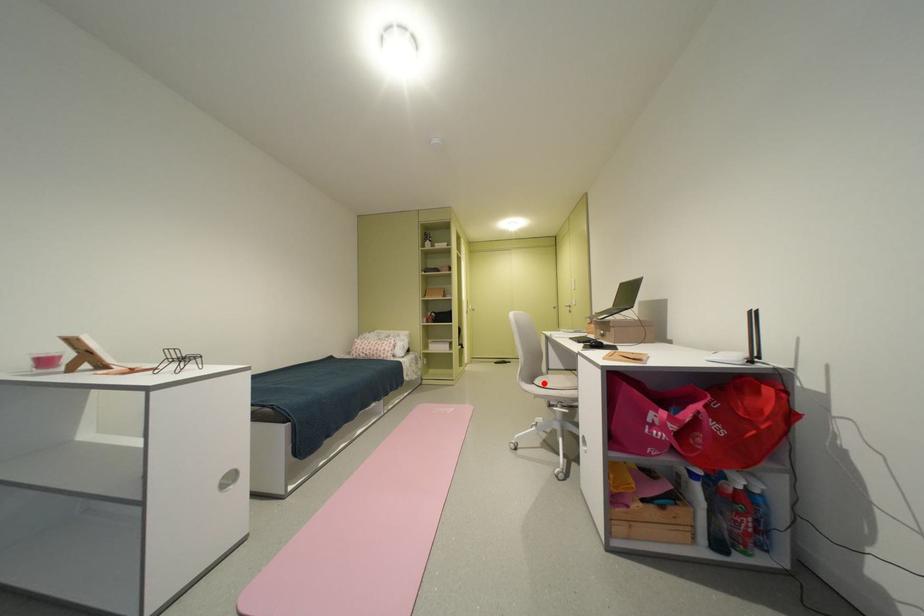
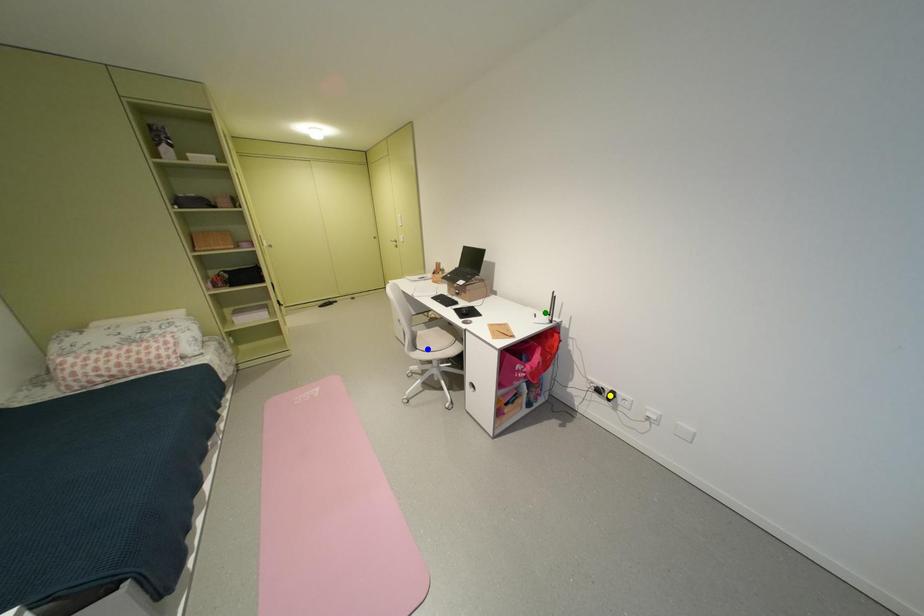
Question: I am providing you with two images of the same scene from different viewpoints. A red point is marked on the first image. You are given multiple points on the second image. Can you choose the point in image 2 that corresponds to the point in image 1?

Choices:
 (A) yellow point
 (B) green point
 (C) blue point

Answer: (C)